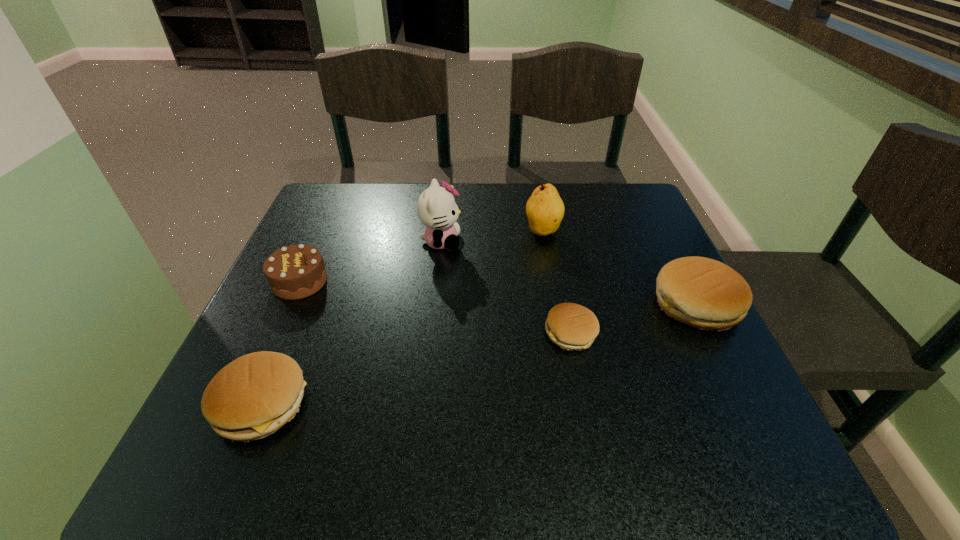
Identify the location of the second shortest patty. The height and width of the screenshot is (540, 960). (253, 396).

The width and height of the screenshot is (960, 540). I want to click on the nearest patty, so click(x=253, y=396).

Find the location of `the second patty from left to right`. the second patty from left to right is located at coordinates (571, 326).

Locate an element on the screen. This screenshot has height=540, width=960. the shortest object is located at coordinates (571, 326).

Identify the location of the rightmost object. The height and width of the screenshot is (540, 960). (704, 293).

Locate an element on the screen. the second tallest object is located at coordinates (545, 209).

At what (x,y) coordinates should I click in order to perform the action: click on kitten. Please return your answer as a coordinate pair (x, y). Looking at the image, I should click on (436, 207).

You are a GUI agent. You are given a task and a screenshot of the screen. Output one action in this format:
    pyautogui.click(x=<x>, y=<y>)
    Task: Click on the tallest object
    This screenshot has width=960, height=540.
    Given the screenshot: What is the action you would take?
    pyautogui.click(x=436, y=207)

Where is `chocolate cake`? The width and height of the screenshot is (960, 540). chocolate cake is located at coordinates (294, 272).

The width and height of the screenshot is (960, 540). I want to click on vacant position located 0.120m on the right of the fifth tallest object, so click(379, 404).